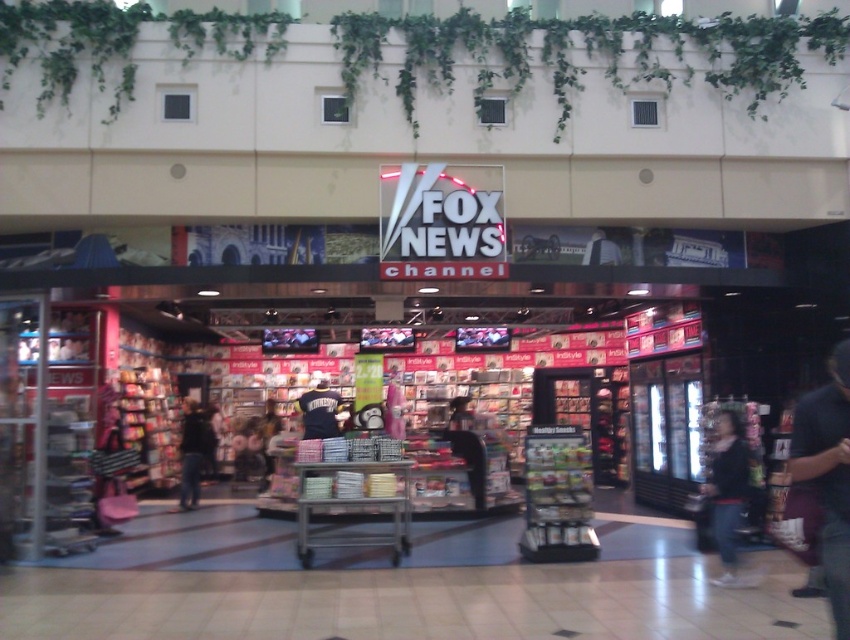
Is dark blue shirt at lower right wider than dark blue shirt at center?

No.

In the scene shown: Between dark blue shirt at lower right and dark blue shirt at center, which one has more height?

With more height is dark blue shirt at lower right.

The image size is (850, 640). Find the location of `dark blue shirt at lower right`. dark blue shirt at lower right is located at coordinates (828, 476).

The image size is (850, 640). What are the coordinates of `dark blue shirt at lower right` in the screenshot? It's located at (828, 476).

Between dark clothing at center and black jersey at center, which one has less height?

With less height is black jersey at center.

Does point (197, 404) lie in front of point (329, 416)?

That is False.

This screenshot has width=850, height=640. Identify the location of dark clothing at center. (191, 452).

I want to click on dark clothing at center, so click(x=191, y=452).

From the picture: Does dark blue jeans at lower right have a smaller size compared to black jersey at center?

Correct, dark blue jeans at lower right occupies less space than black jersey at center.

The image size is (850, 640). I want to click on dark blue jeans at lower right, so click(727, 497).

Where is `dark blue jeans at lower right`? This screenshot has width=850, height=640. dark blue jeans at lower right is located at coordinates (727, 497).